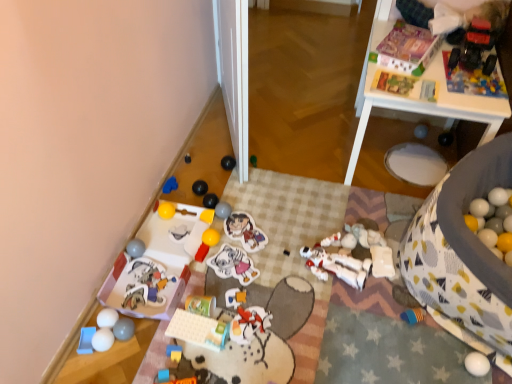
Identify the location of vacant space that is in between white matte doll at center, acting as the 22th toy starting from the left, and rubber ball at center, the tenth toy when ordered from right to left. (268, 238).